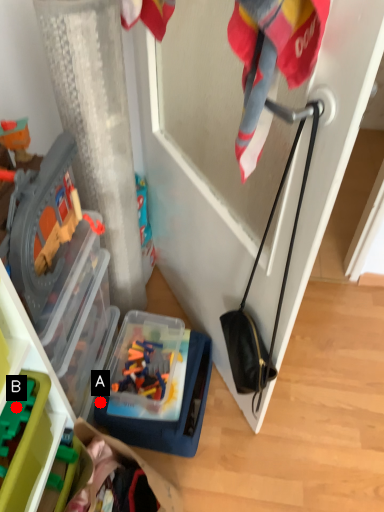
Question: Two points are circled on the image, labeled by A and B beside each circle. Which point appears closest to the camera in this image?

Choices:
 (A) A is closer
 (B) B is closer

Answer: (B)